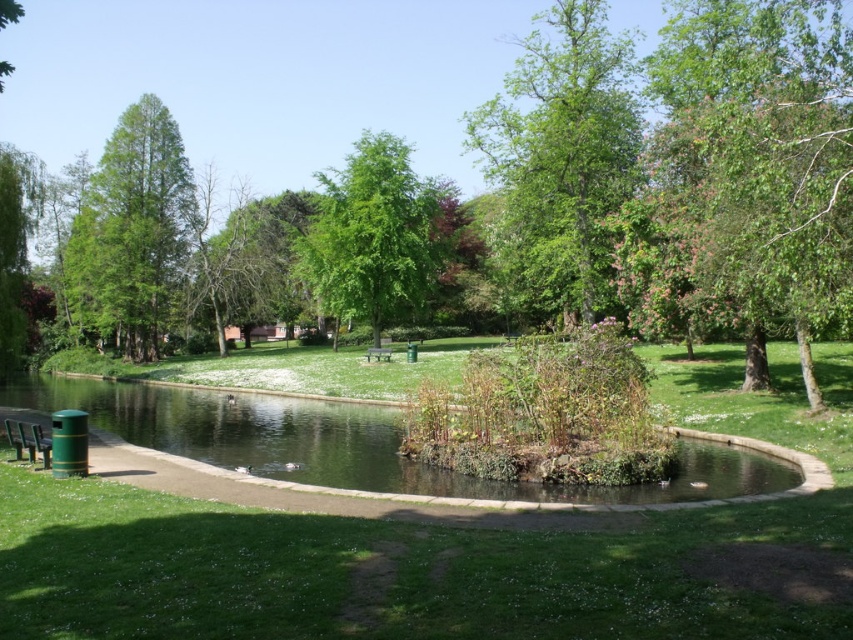
Question: Does green leafy tree at upper center have a lesser width compared to green leafy tree at center?

Choices:
 (A) yes
 (B) no

Answer: (B)

Question: Can you confirm if green grassy water at lower left is positioned below green matte tree at upper left?

Choices:
 (A) no
 (B) yes

Answer: (B)

Question: Which object is the farthest from the dark gray plastic bench at center?

Choices:
 (A) green leafy tree at upper center
 (B) green matte tree at upper left

Answer: (A)

Question: Among these objects, which one is nearest to the camera?

Choices:
 (A) green leafy tree at upper right
 (B) dark gray plastic bench at center
 (C) green leafy tree at center

Answer: (A)

Question: Among these objects, which one is farthest from the camera?

Choices:
 (A) green grassy water at lower left
 (B) green leafy tree at upper right
 (C) dark gray plastic bench at center

Answer: (C)

Question: Is green leafy tree at upper center positioned in front of dark gray plastic bench at center?

Choices:
 (A) no
 (B) yes

Answer: (B)